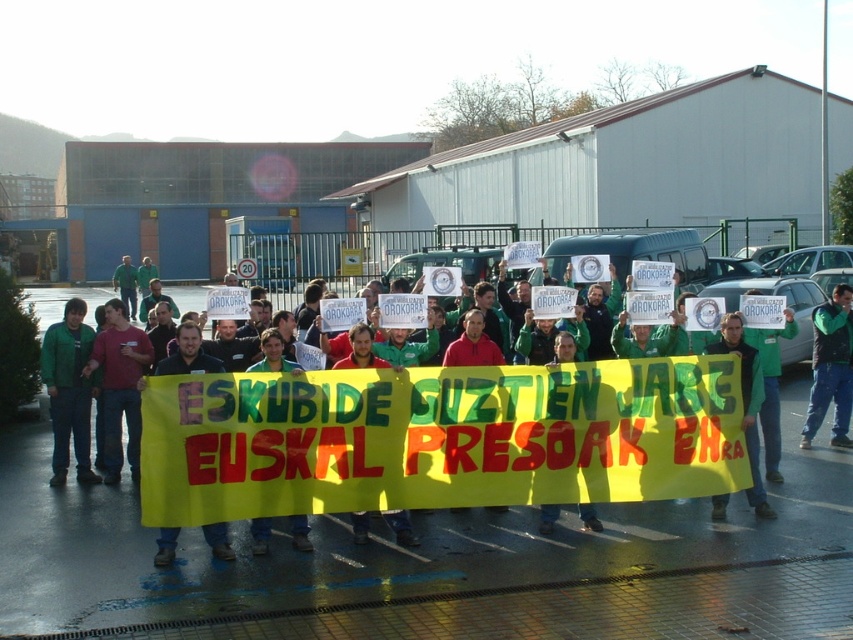
You are a photographer trying to capture the protest scene. You want to ensure both the yellow fabric banner at center and the green fabric sign at center are clearly visible in your photo. Based on their positions, which banner should you focus on first to frame them properly?

The yellow fabric banner at center is to the left of the green fabric sign at center, so you should focus on the yellow fabric banner at center first to frame both properly in your photo.

You are a photographer trying to capture the protest scene. You notice the green matte jacket at left and the green fabric banner at center. Which object should you focus on to ensure it appears larger in your photo?

The green matte jacket at left is larger in size compared to the green fabric banner at center, so focusing on it will make it appear larger in the photo.